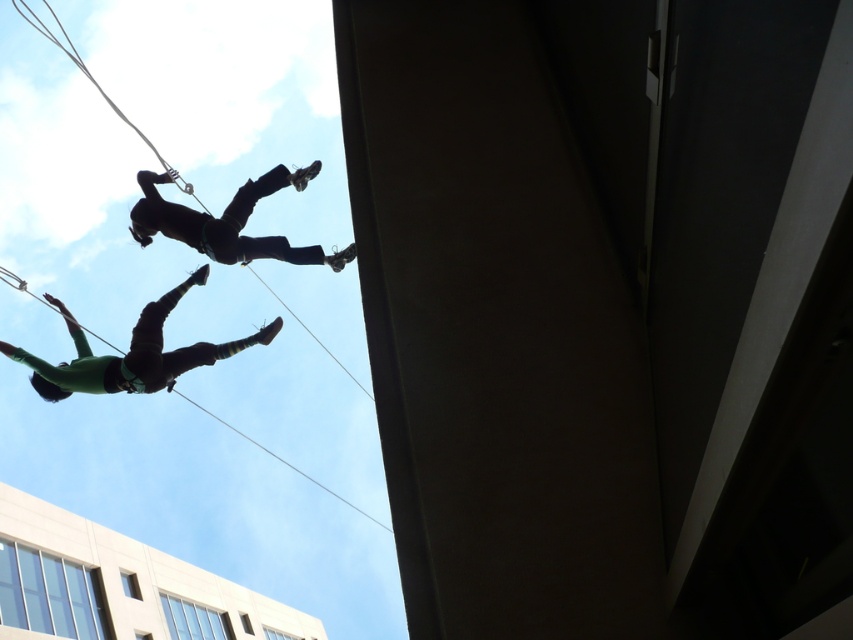
Question: Which of the following is the farthest from the observer?

Choices:
 (A) black matte/soft material person at upper center
 (B) green matte/silky shirt at lower left

Answer: (B)

Question: Does green matte/silky shirt at lower left have a lesser width compared to black matte/soft material person at upper center?

Choices:
 (A) yes
 (B) no

Answer: (B)

Question: Considering the relative positions of green matte/silky shirt at lower left and black matte/soft material person at upper center in the image provided, where is green matte/silky shirt at lower left located with respect to black matte/soft material person at upper center?

Choices:
 (A) below
 (B) above

Answer: (A)

Question: Can you confirm if green matte/silky shirt at lower left is positioned below black matte/soft material person at upper center?

Choices:
 (A) no
 (B) yes

Answer: (B)

Question: Among these objects, which one is farthest from the camera?

Choices:
 (A) green matte/silky shirt at lower left
 (B) black matte/soft material person at upper center

Answer: (A)